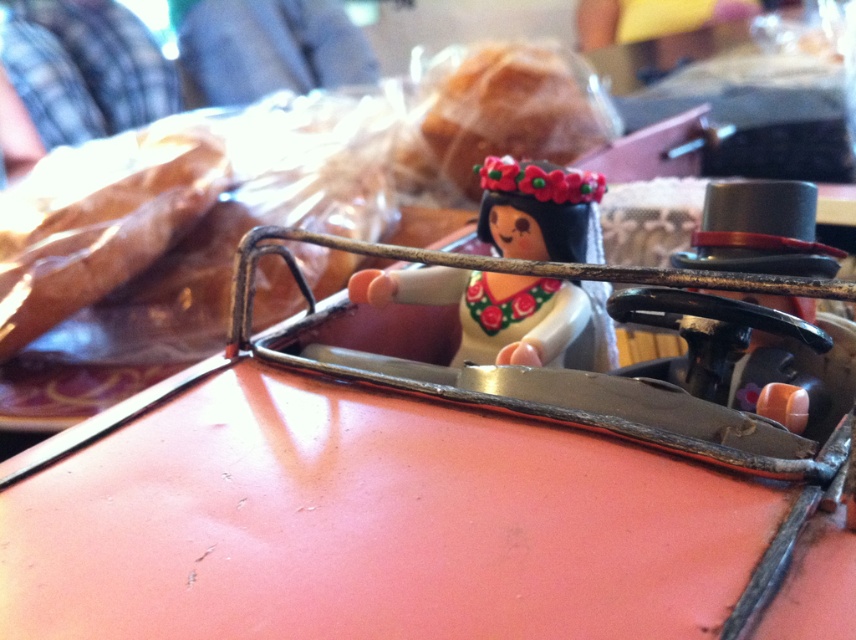
Question: Among these points, which one is nearest to the camera?

Choices:
 (A) (88, 426)
 (B) (393, 296)

Answer: (A)

Question: Observing the image, what is the correct spatial positioning of matte orange toy car at center in reference to matte plastic bread at upper center?

Choices:
 (A) below
 (B) above

Answer: (A)

Question: Which object is positioned closest to the matte plastic bread at upper center?

Choices:
 (A) matte plastic doll at center
 (B) matte orange toy car at center

Answer: (A)

Question: In this image, where is matte orange toy car at center located relative to matte plastic doll at center?

Choices:
 (A) below
 (B) above

Answer: (A)

Question: Is the position of matte orange toy car at center less distant than that of matte plastic bread at upper center?

Choices:
 (A) yes
 (B) no

Answer: (A)

Question: Which object appears farthest from the camera in this image?

Choices:
 (A) matte orange toy car at center
 (B) matte plastic doll at center
 (C) matte plastic bread at upper center

Answer: (C)